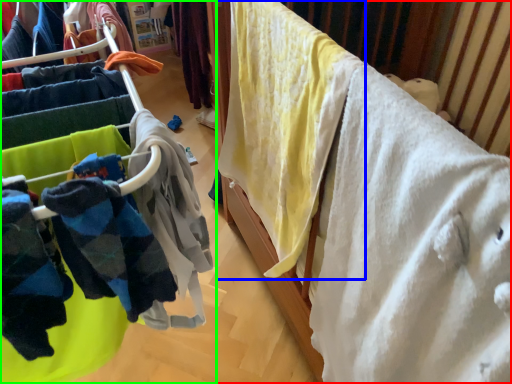
Question: Which object is positioned farthest from furniture (highlighted by a red box)? Select from clothing (highlighted by a blue box) and closet (highlighted by a green box).

Choices:
 (A) clothing
 (B) closet

Answer: (B)